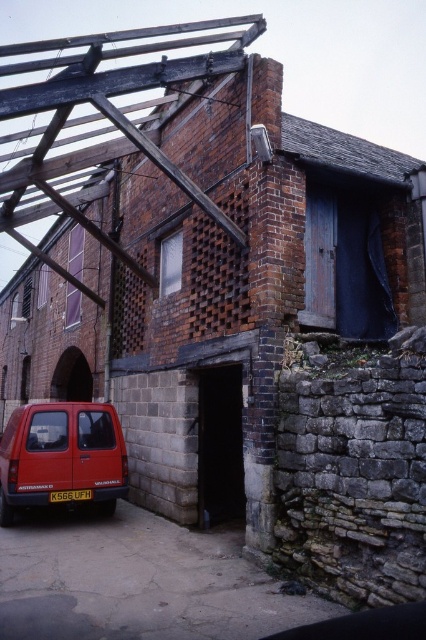
Does black stone door at lower center appear under yellow plastic license plate at lower center?

No.

Between black stone door at lower center and yellow plastic license plate at lower center, which one has more height?

black stone door at lower center

Who is more forward, [233,365] or [66,497]?

Point [233,365] is in front.

Where is `black stone door at lower center`? The height and width of the screenshot is (640, 426). black stone door at lower center is located at coordinates (219, 445).

Is matte red van at lower left to the left of yellow plastic license plate at lower center from the viewer's perspective?

Yes, matte red van at lower left is to the left of yellow plastic license plate at lower center.

Is matte red van at lower left to the right of yellow plastic license plate at lower center from the viewer's perspective?

In fact, matte red van at lower left is to the left of yellow plastic license plate at lower center.

Who is more distant from viewer, (28, 412) or (51, 499)?

Point (28, 412)

You are a GUI agent. You are given a task and a screenshot of the screen. Output one action in this format:
    pyautogui.click(x=<x>, y=<y>)
    Task: Click on the matte red van at lower left
    The image size is (426, 640).
    Given the screenshot: What is the action you would take?
    pyautogui.click(x=60, y=454)

Can you confirm if matte red van at lower left is positioned below black stone door at lower center?

Yes, matte red van at lower left is below black stone door at lower center.

Is point (14, 412) more distant than point (222, 518)?

Yes, it is.

Is point (83, 468) less distant than point (210, 465)?

Yes, point (83, 468) is in front of point (210, 465).

Locate an element on the screen. matte red van at lower left is located at coordinates (60, 454).